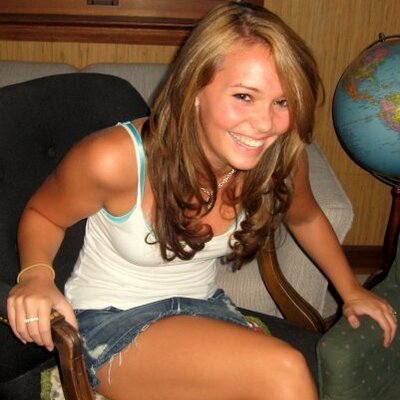
The image size is (400, 400). In order to click on chair handle in this screenshot , I will do (x=4, y=292), (x=56, y=328).